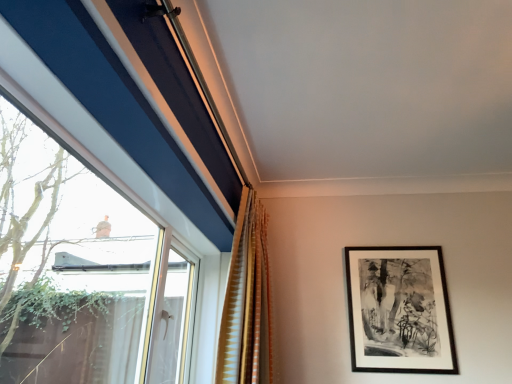
Question: From the image's perspective, relative to black matte picture frame at upper right, is gold textured curtain at center above or below?

Choices:
 (A) above
 (B) below

Answer: (A)

Question: From their relative heights in the image, would you say gold textured curtain at center is taller or shorter than black matte picture frame at upper right?

Choices:
 (A) short
 (B) tall

Answer: (B)

Question: From a real-world perspective, relative to black matte picture frame at upper right, is gold textured curtain at center vertically above or below?

Choices:
 (A) above
 (B) below

Answer: (A)

Question: Looking at their shapes, would you say black matte picture frame at upper right is wider or thinner than gold textured curtain at center?

Choices:
 (A) wide
 (B) thin

Answer: (B)

Question: From a real-world perspective, relative to gold textured curtain at center, is black matte picture frame at upper right vertically above or below?

Choices:
 (A) below
 (B) above

Answer: (A)

Question: Is point (396, 364) positioned closer to the camera than point (222, 352)?

Choices:
 (A) farther
 (B) closer

Answer: (A)

Question: From their relative heights in the image, would you say black matte picture frame at upper right is taller or shorter than gold textured curtain at center?

Choices:
 (A) short
 (B) tall

Answer: (A)